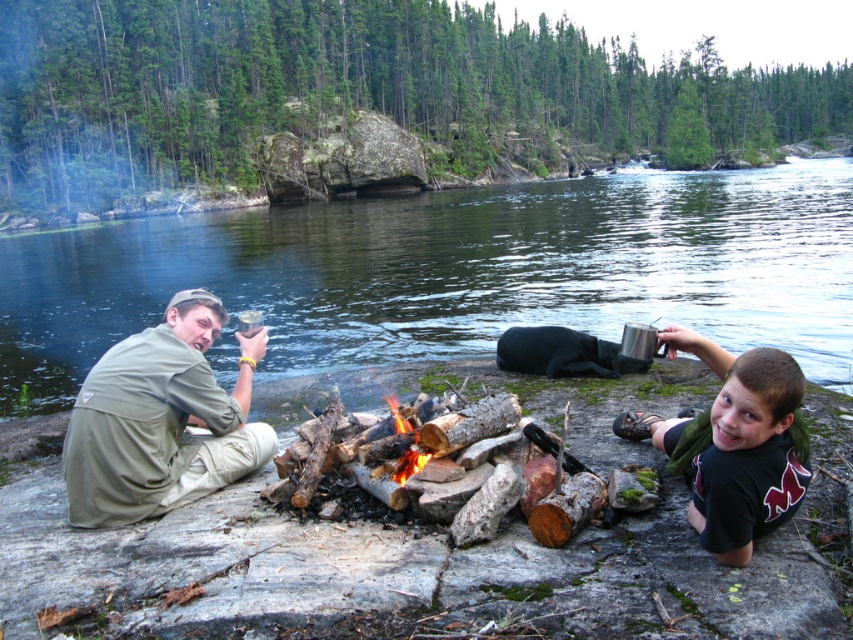
You are planning to cross the river using a small wooden bridge that can only support objects wider than the black matte shirt at lower right. Can the clear water at river center flow under the bridge without causing overflow?

The clear water at river center is wider than the black matte shirt at lower right, so the bridge can support it as the water width is sufficient to flow underneath without overflow.

You are standing at the edge of the river and want to cross to the other side. The clear water at river center is 6.39 meters away from you. If your inflatable boat can carry a maximum weight of 100 kg and you weigh 70 kg, how many 10 kg camping items can you safely take with you without exceeding the boat capacity?

The boat can carry a maximum of 100 kg. Subtracting your weight of 70 kg, you have 30 kg remaining. Each camping item weighs 10 kg, so you can safely take 3 items. The distance to the clear water at river center is 6.39 meters, but this does not affect the boat capacity calculation.

You are standing at the edge of the river and want to cross to the other side. The clear water at river center is the deepest part. If you want to avoid the deepest part, where should you step?

To avoid the deepest part of the clear water at river center, you should step away from the point at coordinates (453, 273), which marks the location of the deepest part.